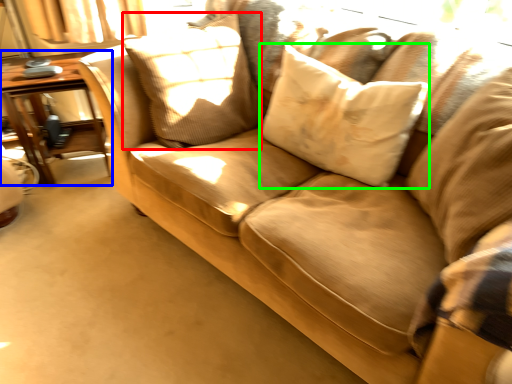
Question: Which object is the closest to the pillow (highlighted by a red box)? Choose among these: table (highlighted by a blue box) or pillow (highlighted by a green box).

Choices:
 (A) table
 (B) pillow

Answer: (B)